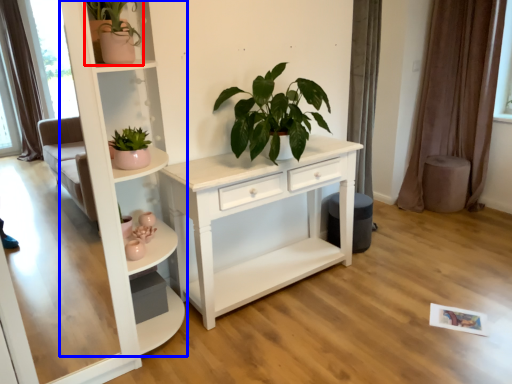
Question: Which of the following is the farthest to the observer, houseplant (highlighted by a red box) or shelf (highlighted by a blue box)?

Choices:
 (A) houseplant
 (B) shelf

Answer: (A)